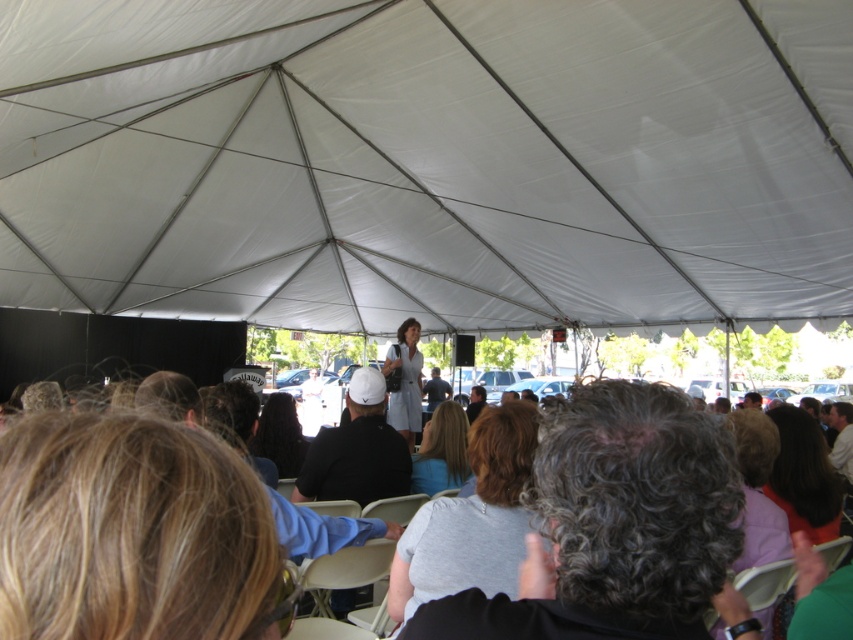
Question: Among these points, which one is nearest to the camera?

Choices:
 (A) (233, 237)
 (B) (312, 496)

Answer: (B)

Question: Does white matte baseball cap at center have a greater width compared to matte gray dress at center?

Choices:
 (A) no
 (B) yes

Answer: (B)

Question: Which point is closer to the camera?

Choices:
 (A) white fabric canopy at center
 (B) gray fabric chairs at center

Answer: (B)

Question: Among these points, which one is nearest to the camera?

Choices:
 (A) (258, 634)
 (B) (618, 248)
 (C) (380, 497)

Answer: (A)

Question: Is white matte baseball cap at center smaller than matte gray dress at center?

Choices:
 (A) yes
 (B) no

Answer: (A)

Question: Can you confirm if white matte baseball cap at center is wider than matte gray dress at center?

Choices:
 (A) yes
 (B) no

Answer: (A)